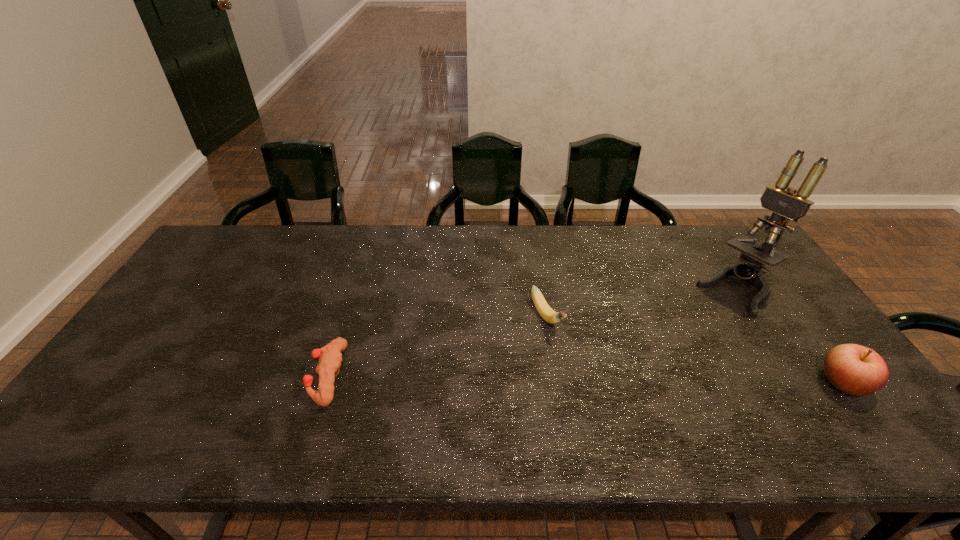
I want to click on vacant space on the desktop that is between the shortest object and the apple and is positioned at the stem of the third tallest object, so click(x=588, y=380).

Locate an element on the screen. vacant space on the desktop that is between the shortest object and the second tallest object and is positioned at the eyepieces of the microscope is located at coordinates (635, 381).